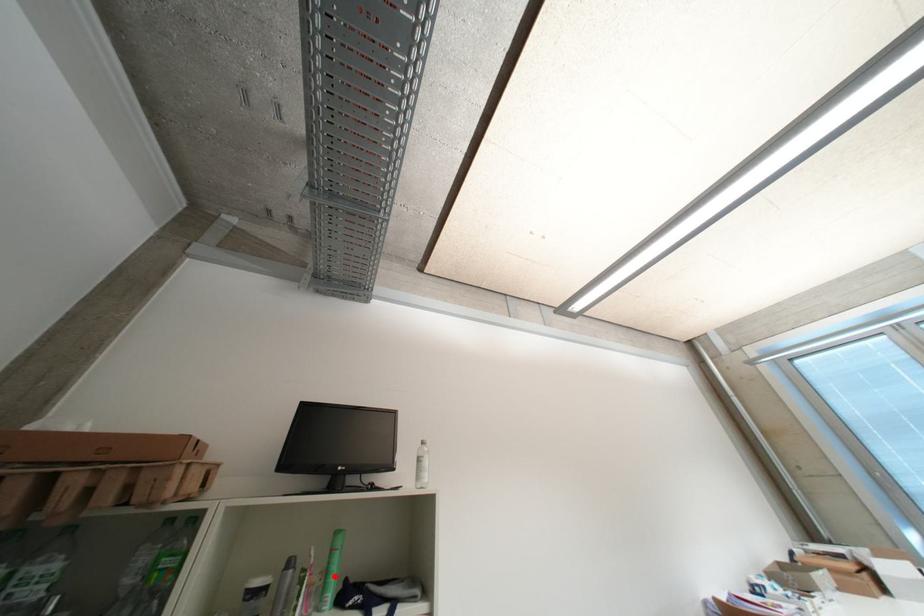
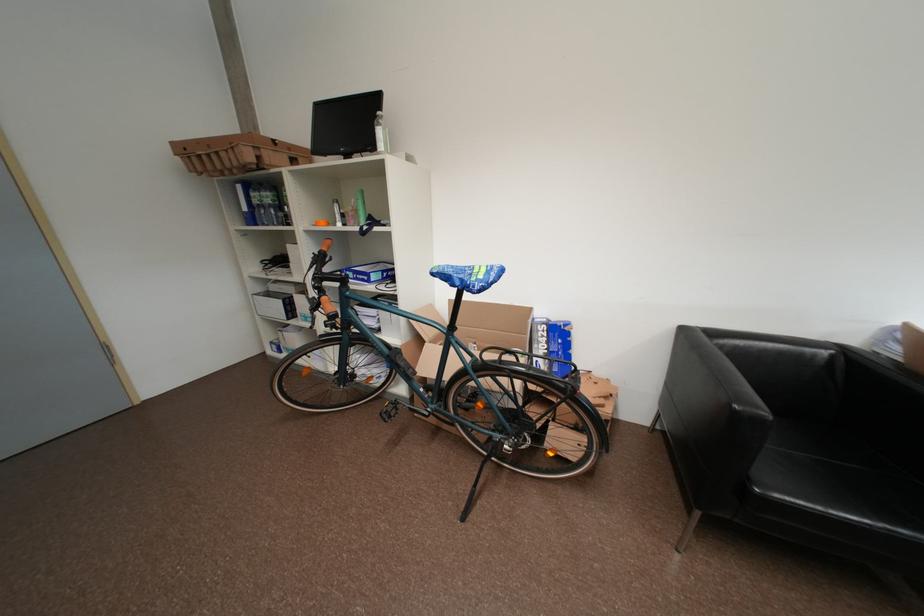
The point at the highlighted location is marked in the first image. Where is the corresponding point in the second image?

(363, 213)